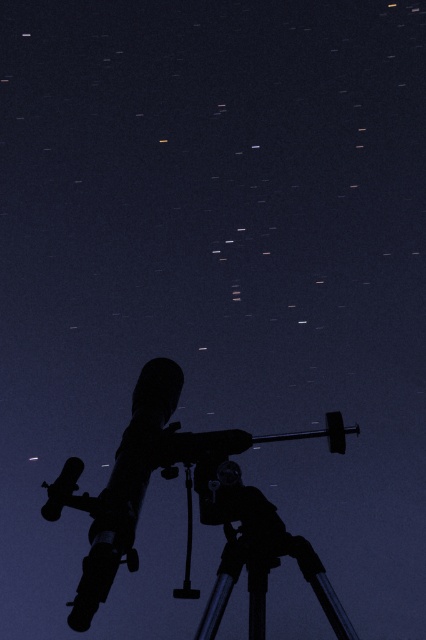
You are an astronomer observing the night sky. You notice a bright star at point (195,451). Is the metallic telescope at center in the same location as this star?

The point (195,451) is where the metallic telescope at center is located, so yes, the metallic telescope at center is at the same location as the star you observed.

You are an astronomer observing the night sky through the telescope. You notice two objects in the image. Which one is taller between the silhouette figure at center and the metallic silver tripod at lower center?

The silhouette figure at center has a greater height compared to the metallic silver tripod at lower center, so the silhouette figure at center is taller.

You are an astronomer setting up equipment for stargazing. You have a silhouette figure at center and a metallic silver tripod at lower center. Can you place a 7.5 inch wide astronomy book between them without moving either object?

The silhouette figure at center and metallic silver tripod at lower center are 7.60 inches apart. Since the astronomy book is 7.5 inches wide, there is enough space between them to place the book without moving either object.